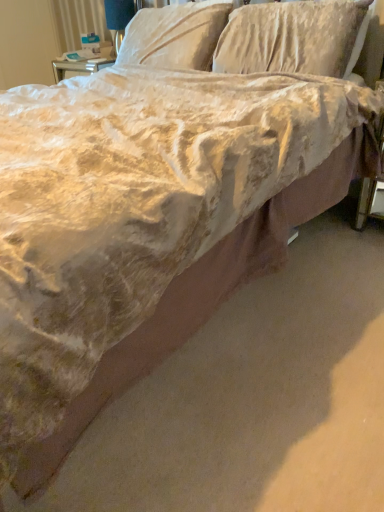
The height and width of the screenshot is (512, 384). What do you see at coordinates (118, 18) in the screenshot? I see `matte white table lamp at upper center` at bounding box center [118, 18].

Image resolution: width=384 pixels, height=512 pixels. Describe the element at coordinates (293, 38) in the screenshot. I see `velvet-like beige pillow at upper center, the second pillow positioned from the left` at that location.

This screenshot has height=512, width=384. What are the coordinates of `velvet-like beige pillow at upper center, acting as the second pillow starting from the right` in the screenshot? It's located at (175, 35).

Where is `matte white table lamp at upper center`? Image resolution: width=384 pixels, height=512 pixels. matte white table lamp at upper center is located at coordinates (118, 18).

Considering the positions of point (218, 8) and point (117, 38), is point (218, 8) closer or farther from the camera than point (117, 38)?

Point (218, 8) appears to be closer to the viewer than point (117, 38).

Is matte white table lamp at upper center at the back of velvet-like beige pillow at upper center, which is counted as the 1th pillow, starting from the left?

No.

Is velvet-like beige pillow at upper center, which is counted as the 1th pillow, starting from the left, shorter than matte white table lamp at upper center?

Correct, velvet-like beige pillow at upper center, which is counted as the 1th pillow, starting from the left, is not as tall as matte white table lamp at upper center.

From a real-world perspective, is velvet-like beige pillow at upper center, acting as the second pillow starting from the right, under matte white table lamp at upper center?

No, from a real-world perspective, velvet-like beige pillow at upper center, acting as the second pillow starting from the right, is not beneath matte white table lamp at upper center.

From a real-world perspective, who is located lower, matte white table lamp at upper center or velvet-like beige pillow at upper center, the second pillow positioned from the left?

velvet-like beige pillow at upper center, the second pillow positioned from the left.

Would you say matte white table lamp at upper center is outside velvet-like beige pillow at upper center, the 1th pillow when ordered from right to left?

Yes, matte white table lamp at upper center is outside of velvet-like beige pillow at upper center, the 1th pillow when ordered from right to left.

Considering the relative positions of matte white table lamp at upper center and velvet-like beige pillow at upper center, the second pillow positioned from the left, in the image provided, is matte white table lamp at upper center to the left or to the right of velvet-like beige pillow at upper center, the second pillow positioned from the left,?

Clearly, matte white table lamp at upper center is on the left of velvet-like beige pillow at upper center, the second pillow positioned from the left, in the image.

Is matte white table lamp at upper center closer to the viewer compared to velvet-like beige pillow at upper center, the 1th pillow when ordered from right to left?

No, matte white table lamp at upper center is behind velvet-like beige pillow at upper center, the 1th pillow when ordered from right to left.

Considering the relative sizes of velvet-like beige pillow at upper center, which is counted as the 1th pillow, starting from the left, and velvet-like beige pillow at upper center, the second pillow positioned from the left, in the image provided, is velvet-like beige pillow at upper center, which is counted as the 1th pillow, starting from the left, bigger than velvet-like beige pillow at upper center, the second pillow positioned from the left,?

No, velvet-like beige pillow at upper center, which is counted as the 1th pillow, starting from the left, is not bigger than velvet-like beige pillow at upper center, the second pillow positioned from the left.

Based on the photo, from the image's perspective, who appears lower, velvet-like beige pillow at upper center, which is counted as the 1th pillow, starting from the left, or velvet-like beige pillow at upper center, the 1th pillow when ordered from right to left?

velvet-like beige pillow at upper center, the 1th pillow when ordered from right to left, appears lower in the image.

Which object is positioned more to the left, velvet-like beige pillow at upper center, acting as the second pillow starting from the right, or velvet-like beige pillow at upper center, the second pillow positioned from the left?

From the viewer's perspective, velvet-like beige pillow at upper center, acting as the second pillow starting from the right, appears more on the left side.

Between velvet-like beige pillow at upper center, which is counted as the 1th pillow, starting from the left, and velvet-like beige pillow at upper center, the 1th pillow when ordered from right to left, which one is positioned in front?

velvet-like beige pillow at upper center, the 1th pillow when ordered from right to left, is in front.

From their relative heights in the image, would you say matte white table lamp at upper center is taller or shorter than velvet-like beige pillow at upper center, which is counted as the 1th pillow, starting from the left?

Considering their sizes, matte white table lamp at upper center has more height than velvet-like beige pillow at upper center, which is counted as the 1th pillow, starting from the left.

Is point (107, 12) positioned behind point (216, 5)?

Yes.

Which is behind, matte white table lamp at upper center or velvet-like beige pillow at upper center, which is counted as the 1th pillow, starting from the left?

matte white table lamp at upper center is behind.

Between velvet-like beige pillow at upper center, the 1th pillow when ordered from right to left, and matte white table lamp at upper center, which one has less height?

Standing shorter between the two is matte white table lamp at upper center.

Is matte white table lamp at upper center at the back of velvet-like beige pillow at upper center, the second pillow positioned from the left?

No.

From a real-world perspective, is velvet-like beige pillow at upper center, the 1th pillow when ordered from right to left, on matte white table lamp at upper center?

No.

Is velvet-like beige pillow at upper center, the 1th pillow when ordered from right to left, placed right next to matte white table lamp at upper center?

No, velvet-like beige pillow at upper center, the 1th pillow when ordered from right to left, is not touching matte white table lamp at upper center.

Is velvet-like beige pillow at upper center, the second pillow positioned from the left, facing towards velvet-like beige pillow at upper center, acting as the second pillow starting from the right?

No, velvet-like beige pillow at upper center, the second pillow positioned from the left, is not turned towards velvet-like beige pillow at upper center, acting as the second pillow starting from the right.

In the scene shown: Relative to velvet-like beige pillow at upper center, acting as the second pillow starting from the right, is velvet-like beige pillow at upper center, the second pillow positioned from the left, in front or behind?

velvet-like beige pillow at upper center, the second pillow positioned from the left, is in front of velvet-like beige pillow at upper center, acting as the second pillow starting from the right.

Is point (344, 5) farther from viewer compared to point (201, 41)?

That is False.

Locate an element on the screen. The image size is (384, 512). the 1st pillow to the right when counting from the matte white table lamp at upper center is located at coordinates (175, 35).

Where is `the 2nd pillow positioned below the matte white table lamp at upper center (from the image's perspective)`? This screenshot has width=384, height=512. the 2nd pillow positioned below the matte white table lamp at upper center (from the image's perspective) is located at coordinates (293, 38).

Considering their positions, is velvet-like beige pillow at upper center, which is counted as the 1th pillow, starting from the left, positioned further to matte white table lamp at upper center than velvet-like beige pillow at upper center, the second pillow positioned from the left?

velvet-like beige pillow at upper center, the second pillow positioned from the left, lies further to matte white table lamp at upper center than the other object.

Looking at the image, which one is located further to velvet-like beige pillow at upper center, the 1th pillow when ordered from right to left, matte white table lamp at upper center or velvet-like beige pillow at upper center, acting as the second pillow starting from the right?

matte white table lamp at upper center is positioned further to the anchor velvet-like beige pillow at upper center, the 1th pillow when ordered from right to left.

Estimate the real-world distances between objects in this image. Which object is closer to velvet-like beige pillow at upper center, the second pillow positioned from the left, velvet-like beige pillow at upper center, which is counted as the 1th pillow, starting from the left, or matte white table lamp at upper center?

velvet-like beige pillow at upper center, which is counted as the 1th pillow, starting from the left, lies closer to velvet-like beige pillow at upper center, the second pillow positioned from the left, than the other object.

From the image, which object appears to be farther from velvet-like beige pillow at upper center, acting as the second pillow starting from the right, matte white table lamp at upper center or velvet-like beige pillow at upper center, the second pillow positioned from the left?

matte white table lamp at upper center.

When comparing their distances from matte white table lamp at upper center, does velvet-like beige pillow at upper center, the second pillow positioned from the left, or velvet-like beige pillow at upper center, acting as the second pillow starting from the right, seem closer?

Based on the image, velvet-like beige pillow at upper center, acting as the second pillow starting from the right, appears to be nearer to matte white table lamp at upper center.

Based on their spatial positions, is velvet-like beige pillow at upper center, the second pillow positioned from the left, or matte white table lamp at upper center further from velvet-like beige pillow at upper center, acting as the second pillow starting from the right?

Among the two, matte white table lamp at upper center is located further to velvet-like beige pillow at upper center, acting as the second pillow starting from the right.

In order to click on pillow situated between matte white table lamp at upper center and velvet-like beige pillow at upper center, the second pillow positioned from the left, from left to right in this screenshot , I will do `click(175, 35)`.